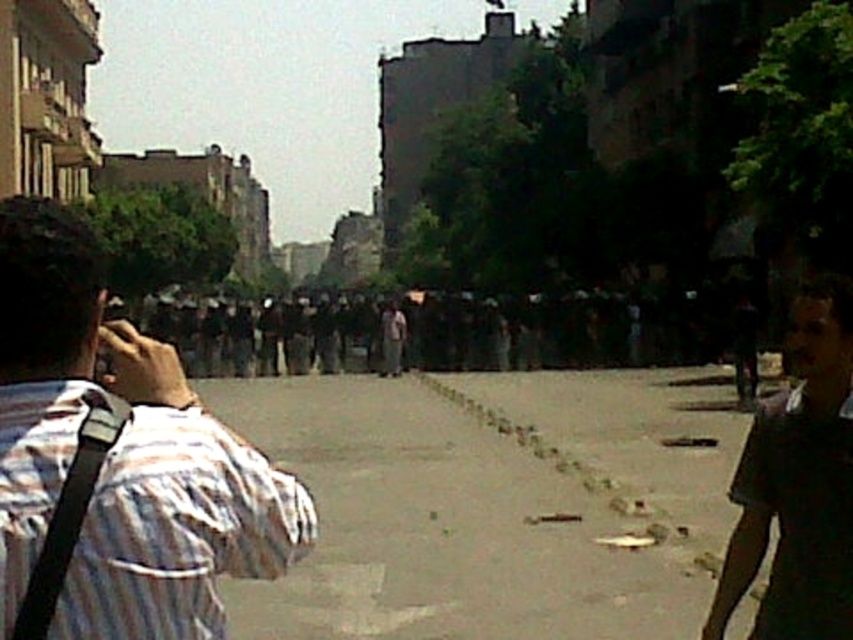
Can you confirm if gray concrete pavement at center is taller than dark brown shirt at lower right?

In fact, gray concrete pavement at center may be shorter than dark brown shirt at lower right.

Can you confirm if gray concrete pavement at center is positioned to the left of dark brown shirt at lower right?

Correct, you'll find gray concrete pavement at center to the left of dark brown shirt at lower right.

I want to click on gray concrete pavement at center, so click(492, 502).

Where is `gray concrete pavement at center`? This screenshot has height=640, width=853. gray concrete pavement at center is located at coordinates (492, 502).

Is point (585, 456) in front of point (306, 490)?

No, (585, 456) is behind (306, 490).

Is gray concrete pavement at center bigger than striped cotton shirt at left?

Indeed, gray concrete pavement at center has a larger size compared to striped cotton shirt at left.

The width and height of the screenshot is (853, 640). Identify the location of gray concrete pavement at center. (492, 502).

Can you confirm if striped cotton shirt at left is positioned below dark brown shirt at lower right?

No, striped cotton shirt at left is not below dark brown shirt at lower right.

Is point (144, 504) less distant than point (741, 548)?

Yes, it is.

Locate an element on the screen. The width and height of the screenshot is (853, 640). striped cotton shirt at left is located at coordinates (119, 458).